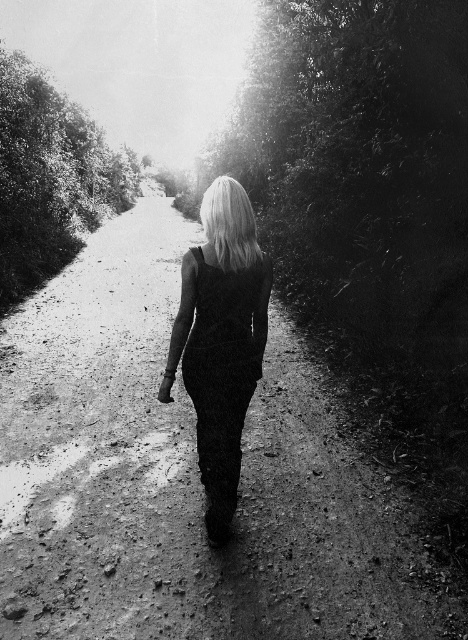
You are analyzing the composition of the image and need to locate the black textured pants at center. What are their 2D coordinates in the image?

The black textured pants at center are located at the 2D coordinates of point (220, 340).

You are standing in the scene and see the point at coordinates (220, 340). What object is this point located on?

The point at coordinates (220, 340) is located on the black textured pants at center.

You are a photographer trying to capture the person in the image. If you want to focus on the black textured pants at center and the blonde hair at center, what is the minimum distance you need to set your camera lens to ensure both are in focus?

The minimum distance required is 1.37 meters, as that is the distance between the black textured pants at center and the blonde hair at center.